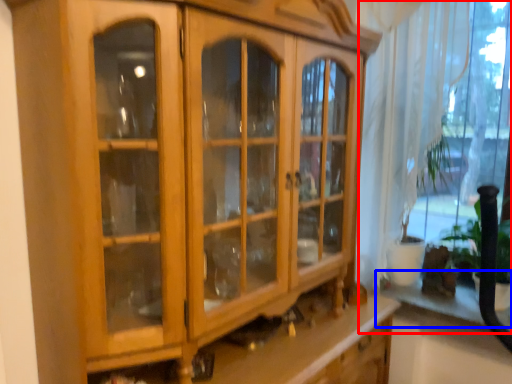
Question: Which object appears farthest to the camera in this image, window (highlighted by a red box) or shelf (highlighted by a blue box)?

Choices:
 (A) window
 (B) shelf

Answer: (B)